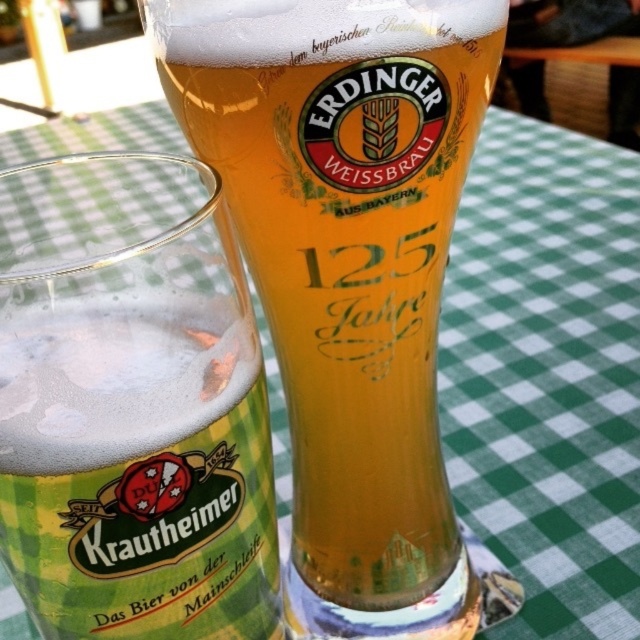
Question: Which point appears farthest from the camera in this image?

Choices:
 (A) (68, 529)
 (B) (412, 353)

Answer: (B)

Question: Is golden glass beer at center to the right of translucent glass krautheimer beer at center from the viewer's perspective?

Choices:
 (A) no
 (B) yes

Answer: (B)

Question: Among these objects, which one is farthest from the camera?

Choices:
 (A) translucent glass krautheimer beer at center
 (B) golden glass beer at center

Answer: (B)

Question: Which point is farther from the camera taking this photo?

Choices:
 (A) (310, 368)
 (B) (106, 604)

Answer: (A)

Question: Can you confirm if golden glass beer at center is smaller than translucent glass krautheimer beer at center?

Choices:
 (A) no
 (B) yes

Answer: (A)

Question: In this image, where is golden glass beer at center located relative to translucent glass krautheimer beer at center?

Choices:
 (A) right
 (B) left

Answer: (A)